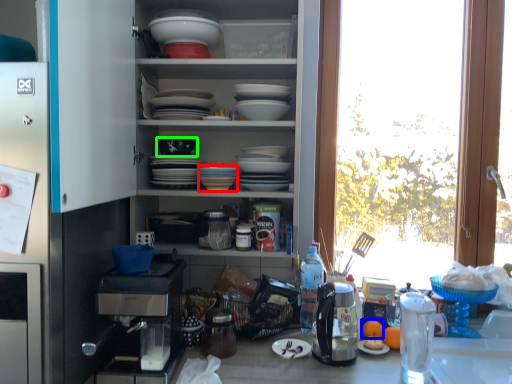
Question: Considering the real-world distances, which object is farthest from tableware (highlighted by a red box)? orange juice (highlighted by a blue box) or bowl (highlighted by a green box)?

Choices:
 (A) orange juice
 (B) bowl

Answer: (A)